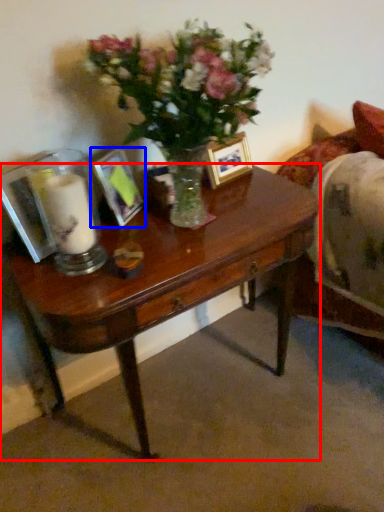
Question: Which of the following is the closest to the observer, desk (highlighted by a red box) or picture frame (highlighted by a blue box)?

Choices:
 (A) desk
 (B) picture frame

Answer: (A)